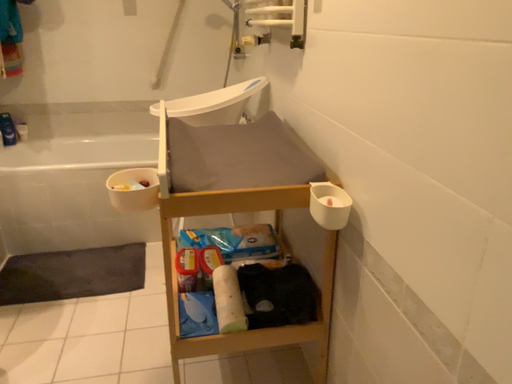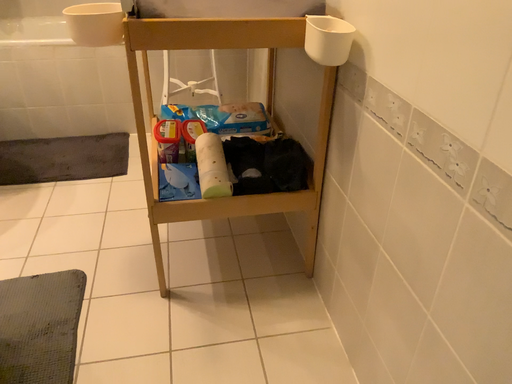
Question: How did the camera likely rotate when shooting the video?

Choices:
 (A) rotated downward
 (B) rotated upward

Answer: (A)